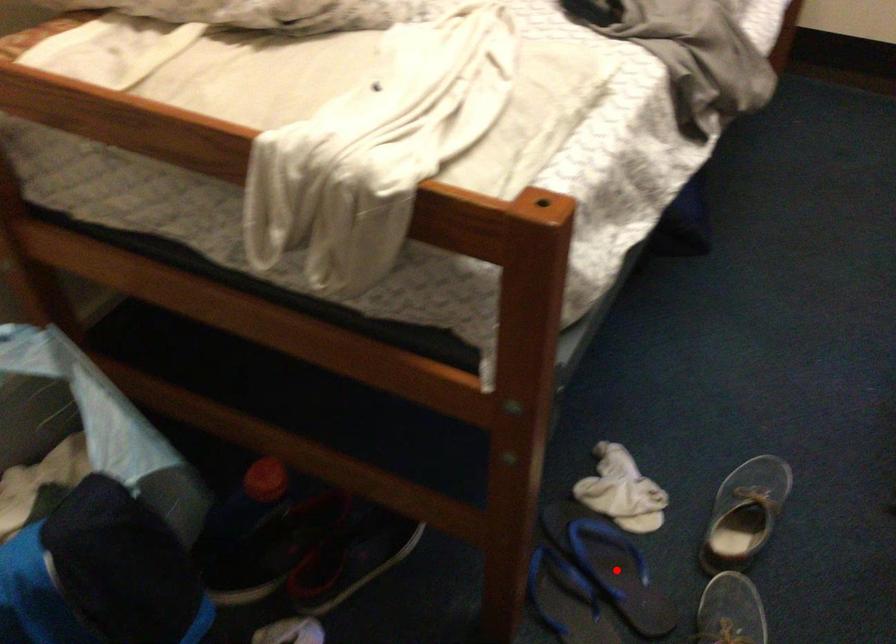
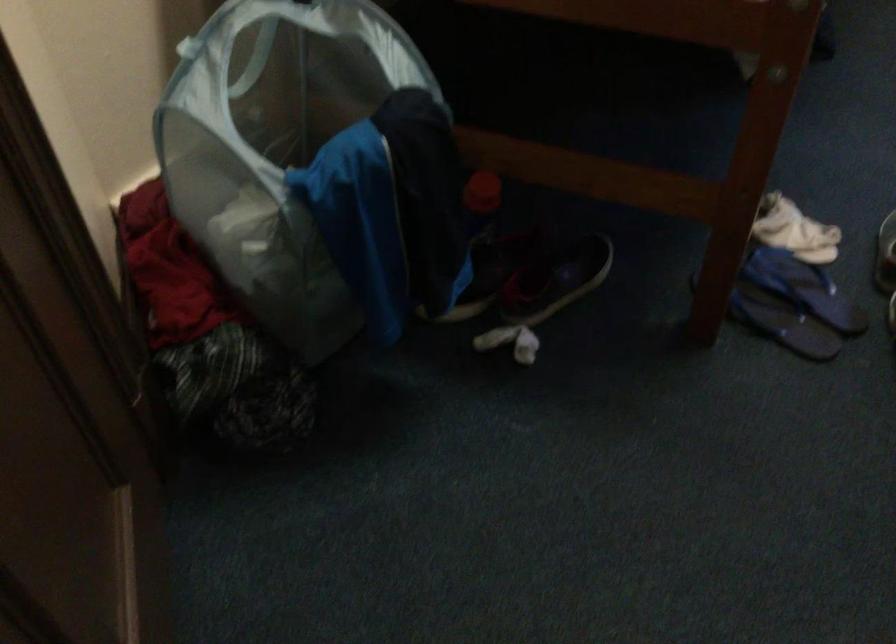
In the second image, find the point that corresponds to the highlighted location in the first image.

(804, 288)